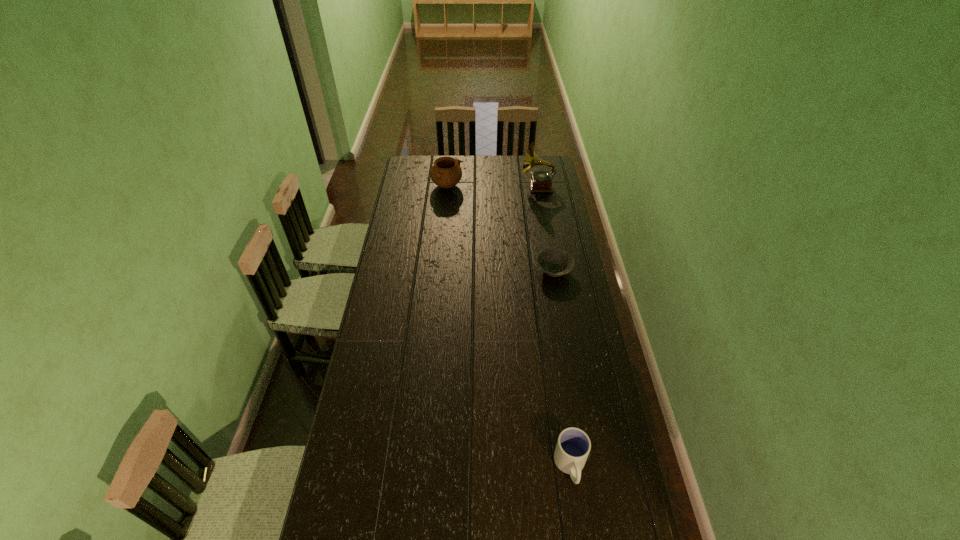
Identify the location of free space that is in between the third shortest object and the third tallest object. (509, 326).

Locate an element on the screen. free space between the cup and the pottery is located at coordinates (509, 326).

Where is `free spot between the pottery and the cup`? free spot between the pottery and the cup is located at coordinates pyautogui.click(x=509, y=326).

Locate an element on the screen. The height and width of the screenshot is (540, 960). free space between the second tallest object and the phonograph_record is located at coordinates (492, 186).

Locate an element on the screen. vacant point located between the third farthest object and the nearest object is located at coordinates (563, 368).

I want to click on free space between the shortest object and the second tallest object, so click(500, 228).

The width and height of the screenshot is (960, 540). Identify the location of unoccupied position between the nearest object and the phonograph_record. (554, 326).

This screenshot has height=540, width=960. Find the location of `free spot between the phonograph_record and the bowl`. free spot between the phonograph_record and the bowl is located at coordinates (546, 228).

Locate an element on the screen. blank region between the second shortest object and the pottery is located at coordinates (509, 326).

Select which object appears as the second closest to the bowl. Please provide its 2D coordinates. Your answer should be formatted as a tuple, i.e. [(x, y)], where the tuple contains the x and y coordinates of a point satisfying the conditions above.

[(446, 172)]